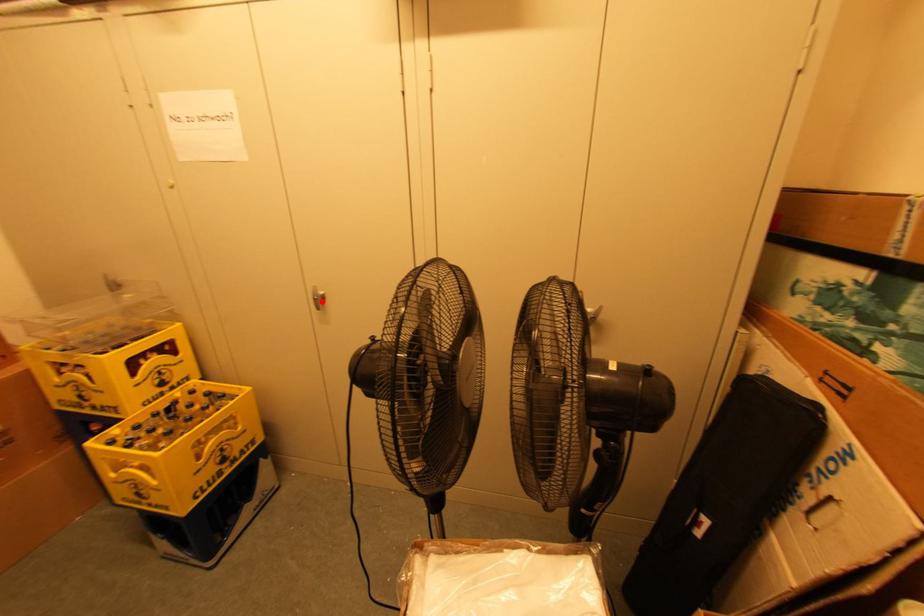
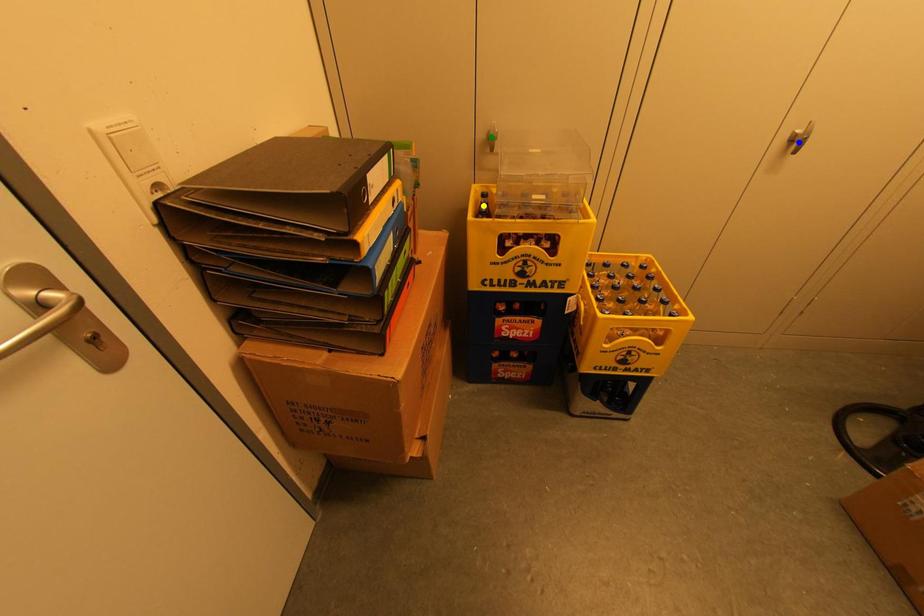
Question: I am providing you with two images of the same scene from different viewpoints. A red point is marked on the first image. You are given multiple points on the second image. Which mark in image 2 goes with the point in image 1?

Choices:
 (A) green point
 (B) yellow point
 (C) blue point

Answer: (C)